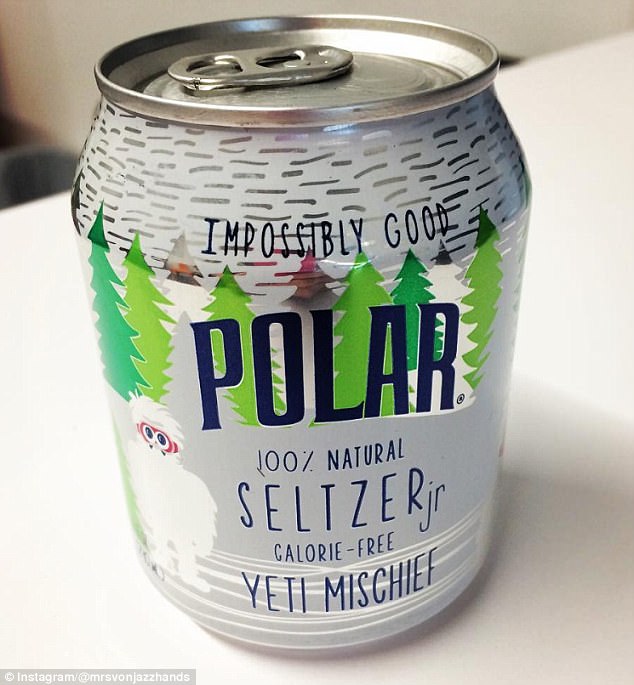
Locate an element on the screen. The width and height of the screenshot is (634, 685). mixer is located at coordinates (345, 357).